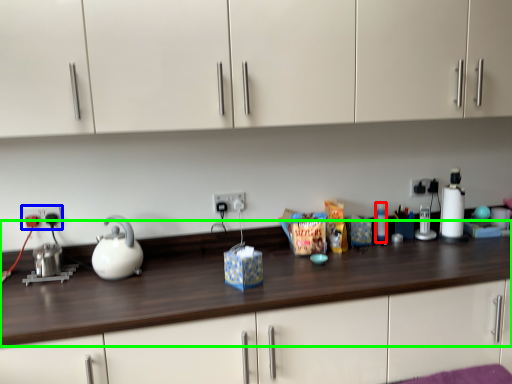
Question: Based on their relative distances, which object is farther from bottle (highlighted by a red box)? Choose from electric outlet (highlighted by a blue box) and counter top (highlighted by a green box).

Choices:
 (A) electric outlet
 (B) counter top

Answer: (A)